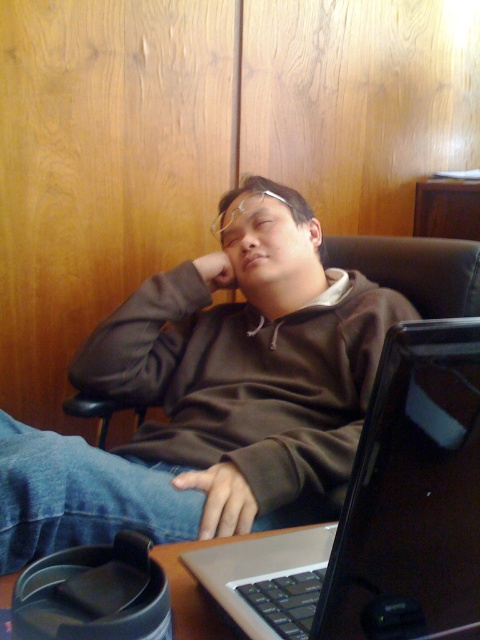
Who is shorter, silver metallic laptop at center or metallic silver laptop at lower center?

metallic silver laptop at lower center

Is silver metallic laptop at center wider than metallic silver laptop at lower center?

No, silver metallic laptop at center is not wider than metallic silver laptop at lower center.

Where is `silver metallic laptop at center`? This screenshot has width=480, height=640. silver metallic laptop at center is located at coordinates (381, 515).

Can you confirm if brown fleece at center is positioned above silver metallic laptop at center?

Yes, brown fleece at center is above silver metallic laptop at center.

Consider the image. Who is lower down, brown fleece at center or silver metallic laptop at center?

silver metallic laptop at center

Who is more distant from viewer, (x=332, y=376) or (x=384, y=432)?

The point (x=332, y=376) is more distant.

In order to click on brown fleece at center in this screenshot , I will do `click(211, 394)`.

Does point (14, 458) lie in front of point (156, 561)?

No, (14, 458) is behind (156, 561).

Between point (126, 502) and point (199, 604), which one is positioned behind?

Point (126, 502)

Who is more distant from viewer, (218, 404) or (178, 552)?

Positioned behind is point (218, 404).

I want to click on brown fleece at center, so click(x=211, y=394).